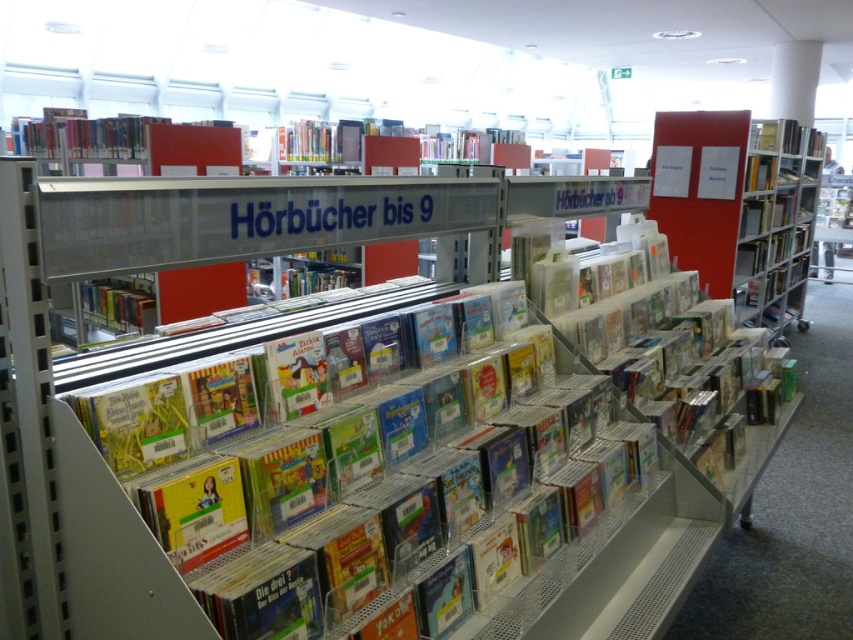
You are in a bookstore looking for audiobooks for children. You see a point marked at coordinate (776, 224). Which object does this point correspond to?

The point at coordinate (776, 224) corresponds to the metallic silver bookshelf at right.